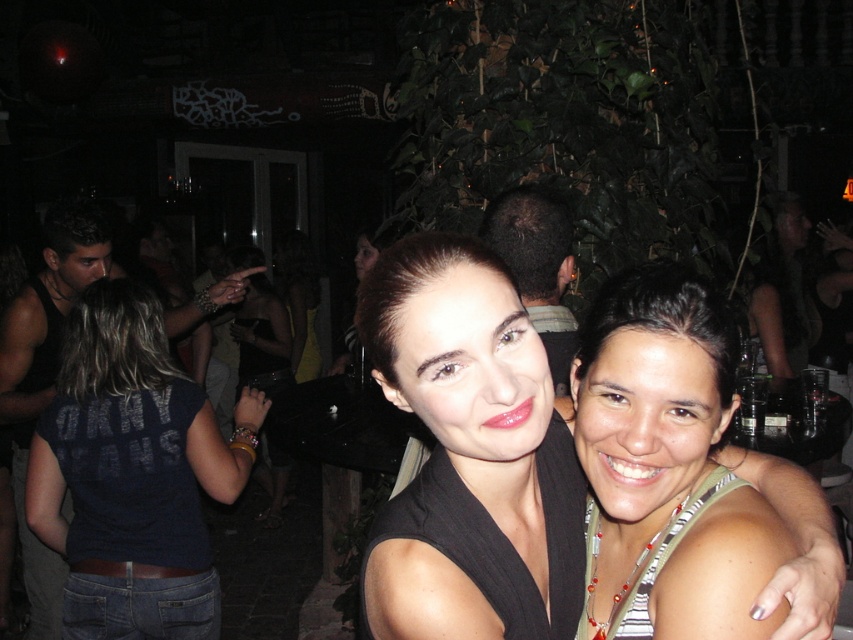
Question: Which object is farther from the camera taking this photo?

Choices:
 (A) matte black top at center
 (B) green striped tank top at center

Answer: (B)

Question: Is matte black top at center positioned at the back of green striped tank top at center?

Choices:
 (A) no
 (B) yes

Answer: (A)

Question: Does green striped tank top at center appear over denim jeans at lower left?

Choices:
 (A) no
 (B) yes

Answer: (B)

Question: Which point is farther from the camera taking this photo?

Choices:
 (A) (55, 461)
 (B) (460, 342)
 (C) (734, 577)

Answer: (A)

Question: Which of these objects is positioned farthest from the green striped tank top at center?

Choices:
 (A) denim jeans at lower left
 (B) matte black top at center

Answer: (A)

Question: Does matte black top at center appear over green striped tank top at center?

Choices:
 (A) yes
 (B) no

Answer: (A)